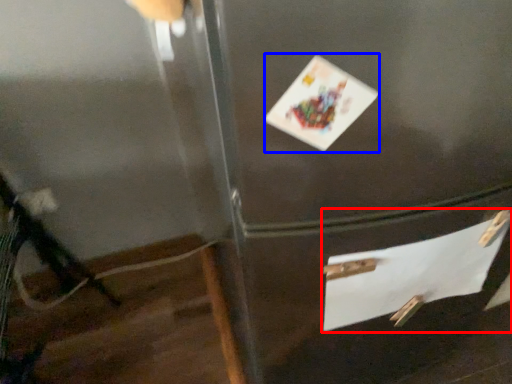
Question: Which object appears closest to the camera in this image, drawer (highlighted by a red box) or postcard (highlighted by a blue box)?

Choices:
 (A) drawer
 (B) postcard

Answer: (B)